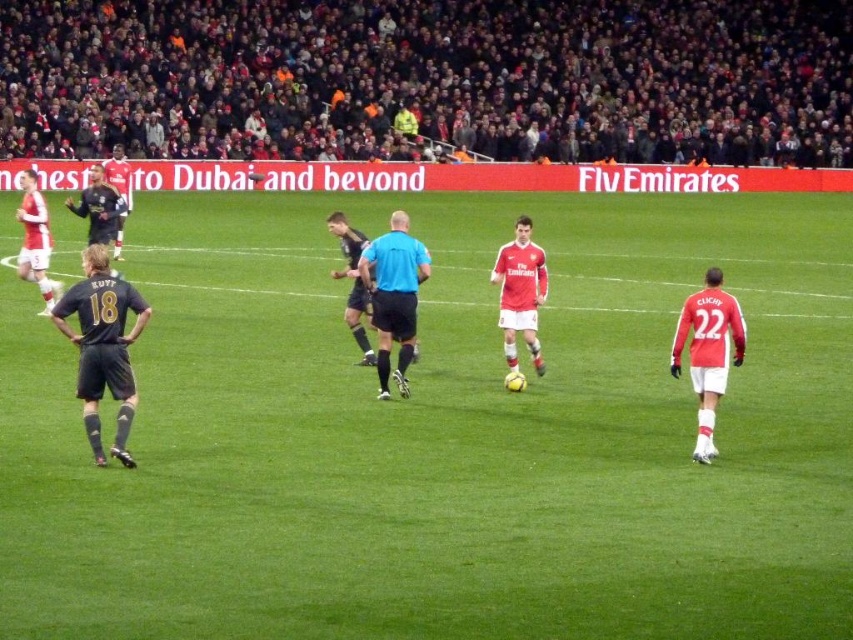
Question: Among these points, which one is nearest to the camera?

Choices:
 (A) (688, 333)
 (B) (35, 234)

Answer: (A)

Question: Does dark blue jersey at left have a smaller size compared to matte red jersey at center?

Choices:
 (A) no
 (B) yes

Answer: (B)

Question: Which of these objects is positioned closest to the matte black jersey at left?

Choices:
 (A) black jersey at left
 (B) dark blue jersey at left
 (C) black smooth soccer ball at center
 (D) green grass soccer field at center

Answer: (A)

Question: Is blue fabric referee at center above black jersey at left?

Choices:
 (A) no
 (B) yes

Answer: (A)

Question: Does green grass soccer field at center have a lesser width compared to red jersey at right?

Choices:
 (A) yes
 (B) no

Answer: (B)

Question: Which of these objects is positioned farthest from the red jersey at right?

Choices:
 (A) matte red jersey at center
 (B) dark blue jersey at left
 (C) black jersey at left
 (D) blue fabric referee at center

Answer: (C)